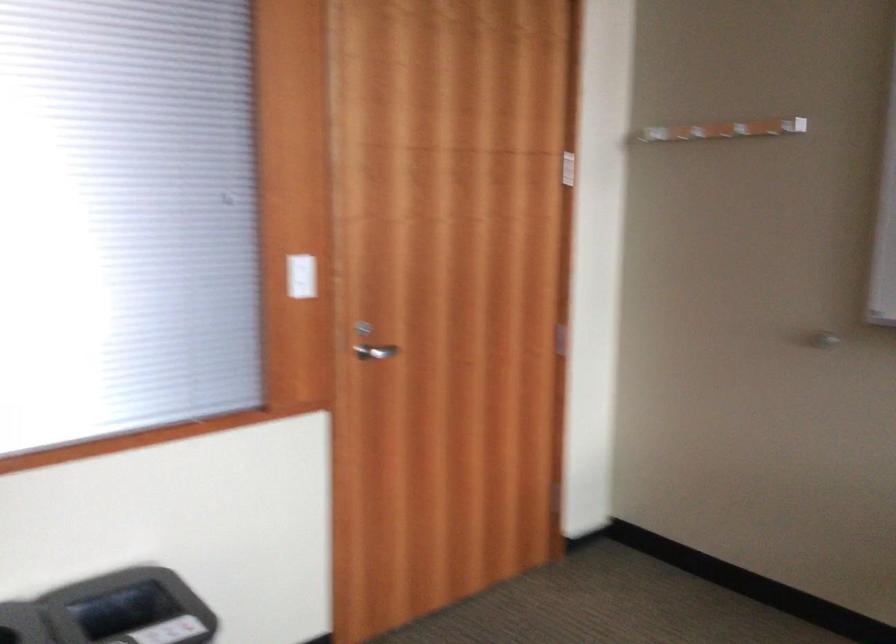
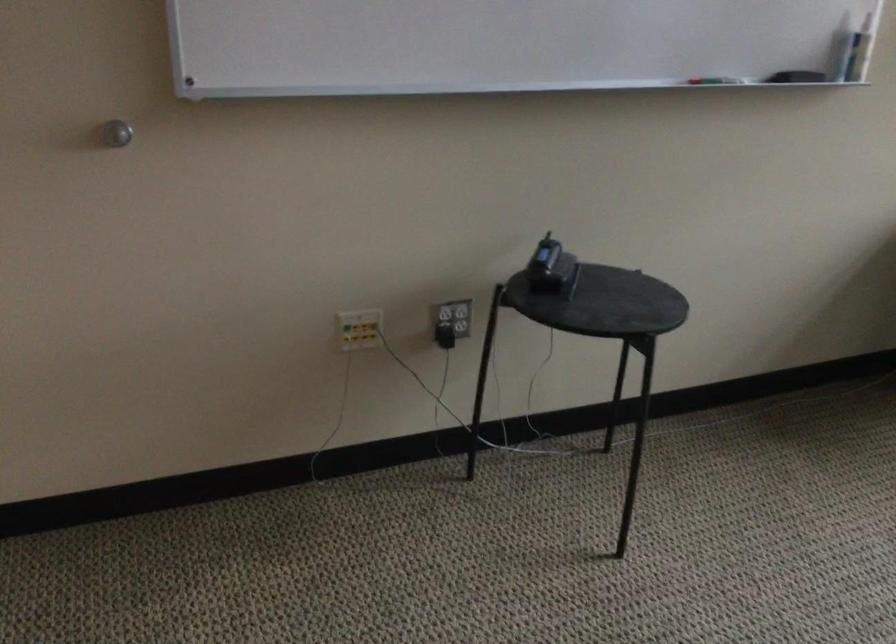
Find the pixel in the second image that matches [796,332] in the first image.

(116, 133)